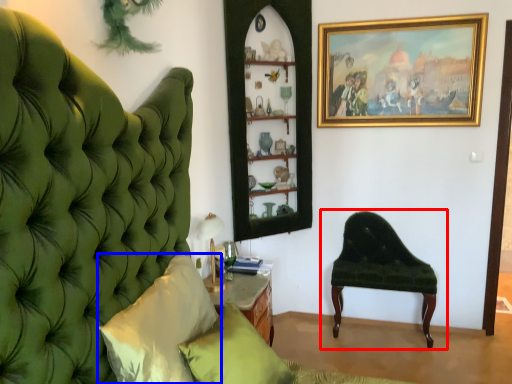
Question: Which point is further to the camera, chair (highlighted by a red box) or pillow (highlighted by a blue box)?

Choices:
 (A) chair
 (B) pillow

Answer: (A)